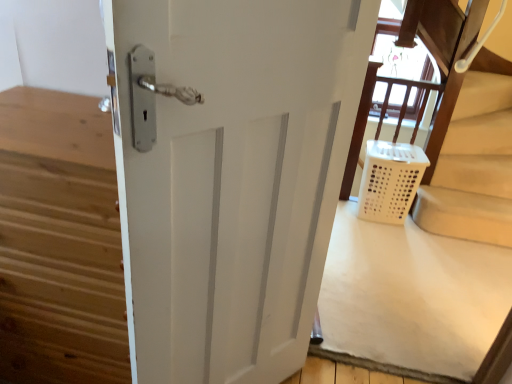
Question: Can you confirm if white plastic laundry basket at lower right is thinner than white matte door at center?

Choices:
 (A) no
 (B) yes

Answer: (B)

Question: Is the surface of white plastic laundry basket at lower right in direct contact with white matte door at center?

Choices:
 (A) no
 (B) yes

Answer: (A)

Question: Considering the relative sizes of white plastic laundry basket at lower right and white matte door at center in the image provided, is white plastic laundry basket at lower right shorter than white matte door at center?

Choices:
 (A) no
 (B) yes

Answer: (B)

Question: Is white plastic laundry basket at lower right oriented towards white matte door at center?

Choices:
 (A) no
 (B) yes

Answer: (A)

Question: Is the depth of white plastic laundry basket at lower right greater than that of white matte door at center?

Choices:
 (A) yes
 (B) no

Answer: (A)

Question: From the image's perspective, relative to white matte door at center, is white plastic laundry basket at lower right above or below?

Choices:
 (A) below
 (B) above

Answer: (B)

Question: Does point (394, 190) appear closer or farther from the camera than point (129, 311)?

Choices:
 (A) farther
 (B) closer

Answer: (A)

Question: Is white plastic laundry basket at lower right situated inside white matte door at center or outside?

Choices:
 (A) outside
 (B) inside

Answer: (A)

Question: From a real-world perspective, relative to white matte door at center, is white plastic laundry basket at lower right vertically above or below?

Choices:
 (A) below
 (B) above

Answer: (A)

Question: Considering their positions, is white plastic laundry basket at lower right located in front of or behind white plastic laundry basket at lower right?

Choices:
 (A) behind
 (B) front

Answer: (B)

Question: Which is correct: white plastic laundry basket at lower right is inside white plastic laundry basket at lower right, or outside of it?

Choices:
 (A) outside
 (B) inside

Answer: (A)

Question: From the image's perspective, is white plastic laundry basket at lower right above or below white plastic laundry basket at lower right?

Choices:
 (A) above
 (B) below

Answer: (B)

Question: Looking at the image, does white plastic laundry basket at lower right seem bigger or smaller compared to white plastic laundry basket at lower right?

Choices:
 (A) small
 (B) big

Answer: (B)

Question: From a real-world perspective, is white matte door at center above or below white plastic laundry basket at lower right?

Choices:
 (A) below
 (B) above

Answer: (B)

Question: In the image, is white matte door at center positioned in front of or behind white plastic laundry basket at lower right?

Choices:
 (A) behind
 (B) front

Answer: (B)